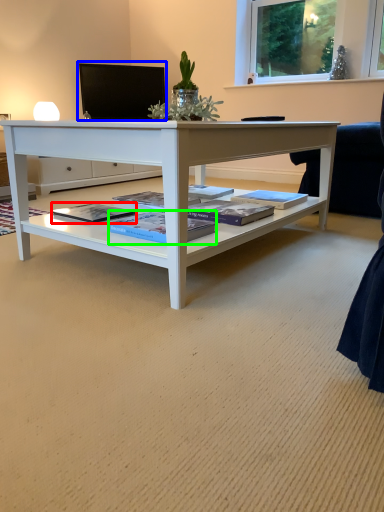
Question: Considering the real-world distances, which object is farthest from magazine (highlighted by a red box)? computer monitor (highlighted by a blue box) or magazine (highlighted by a green box)?

Choices:
 (A) computer monitor
 (B) magazine

Answer: (A)